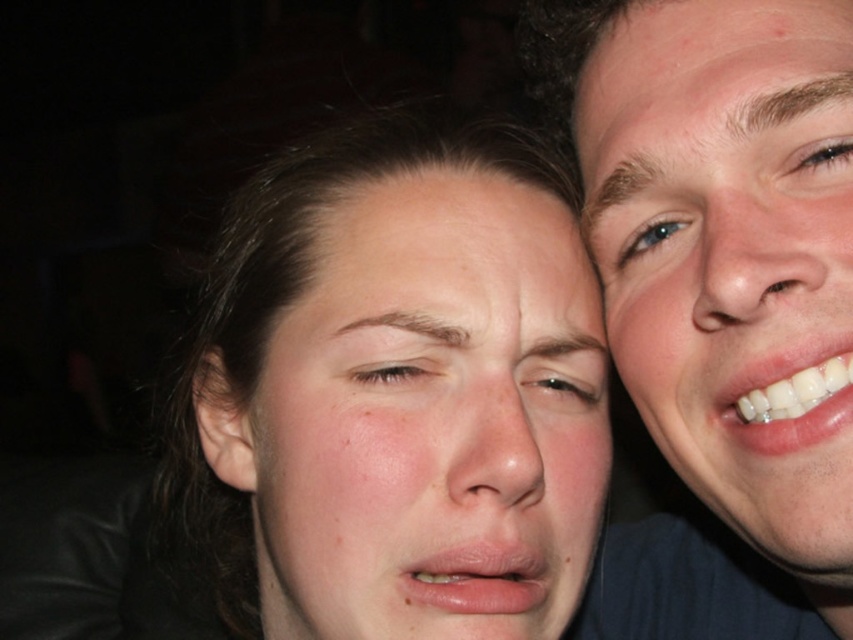
Question: Which object is closer to the camera taking this photo?

Choices:
 (A) shiny brown eye at center
 (B) smooth skin face at center

Answer: (B)

Question: Considering the real-world distances, which object is closest to the smooth skin face at center?

Choices:
 (A) smooth skin face at right
 (B) shiny brown eye at center

Answer: (B)

Question: Can you confirm if smooth skin face at center is positioned to the right of blue glossy eye at upper right?

Choices:
 (A) no
 (B) yes

Answer: (A)

Question: Which point appears farthest from the camera in this image?

Choices:
 (A) (350, 378)
 (B) (552, 388)
 (C) (370, 400)
 (D) (781, 220)

Answer: (B)

Question: Is smooth skin face at center behind light brown skin at center?

Choices:
 (A) yes
 (B) no

Answer: (B)

Question: Can you confirm if smooth skin face at center is wider than shiny brown eye at center?

Choices:
 (A) no
 (B) yes

Answer: (B)